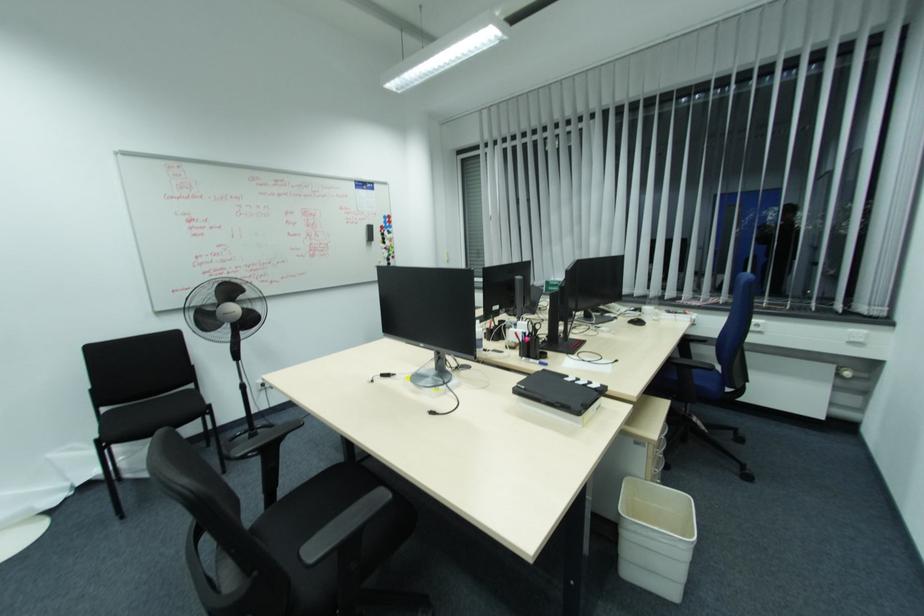
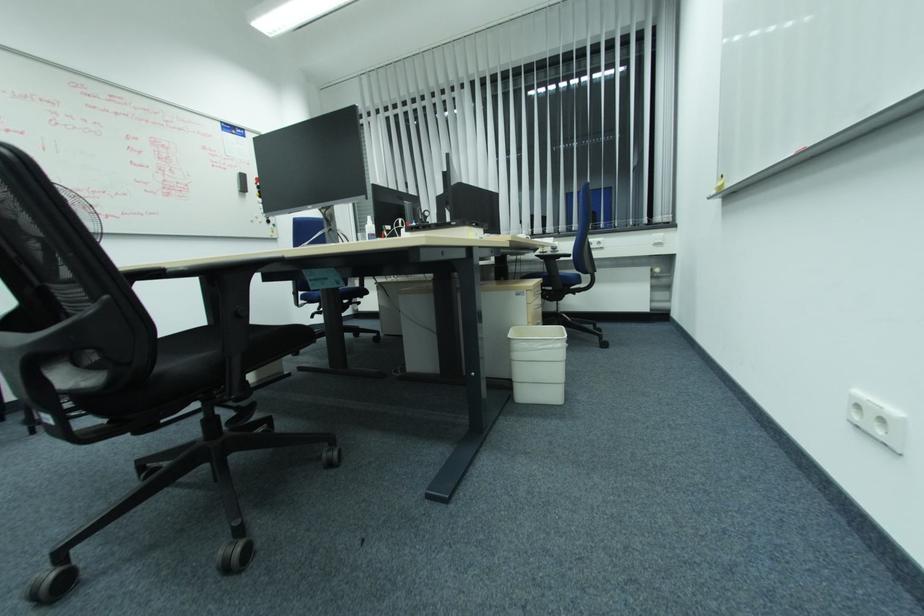
Question: The images are taken continuously from a first-person perspective. In which direction is your viewpoint rotating?

Choices:
 (A) Left
 (B) Right
 (C) Up
 (D) Down

Answer: (B)